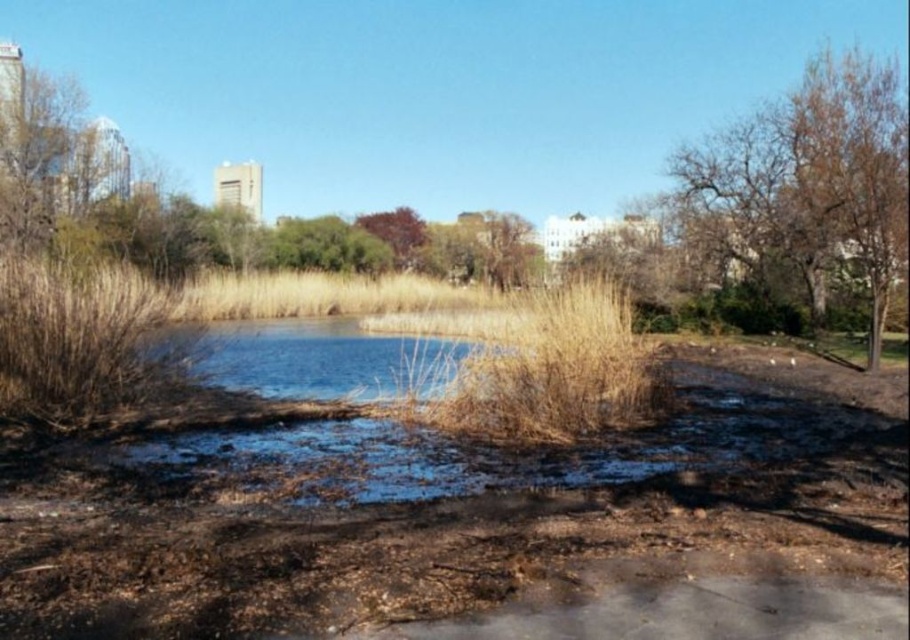
Is dry grass at center to the right of blue water at center from the viewer's perspective?

Correct, you'll find dry grass at center to the right of blue water at center.

Which is below, dry grass at center or blue water at center?

blue water at center is lower down.

Locate an element on the screen. dry grass at center is located at coordinates (546, 368).

Between brown/dry bark tree at right and purple leafy tree at center, which one has less height?

With less height is purple leafy tree at center.

Which is in front, point (872, 68) or point (385, 225)?

Point (872, 68)

Locate an element on the screen. brown/dry bark tree at right is located at coordinates (811, 186).

Is point (417, 376) positioned behind point (396, 248)?

That is False.

Who is higher up, blue water at center or purple leafy tree at center?

purple leafy tree at center

What do you see at coordinates (332, 353) in the screenshot?
I see `blue water at center` at bounding box center [332, 353].

Image resolution: width=910 pixels, height=640 pixels. I want to click on blue water at center, so click(x=332, y=353).